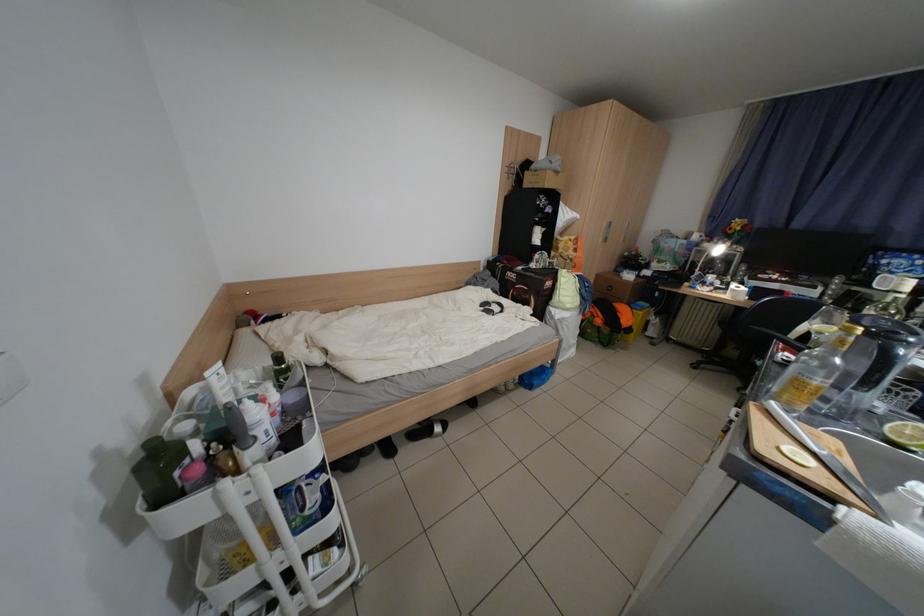
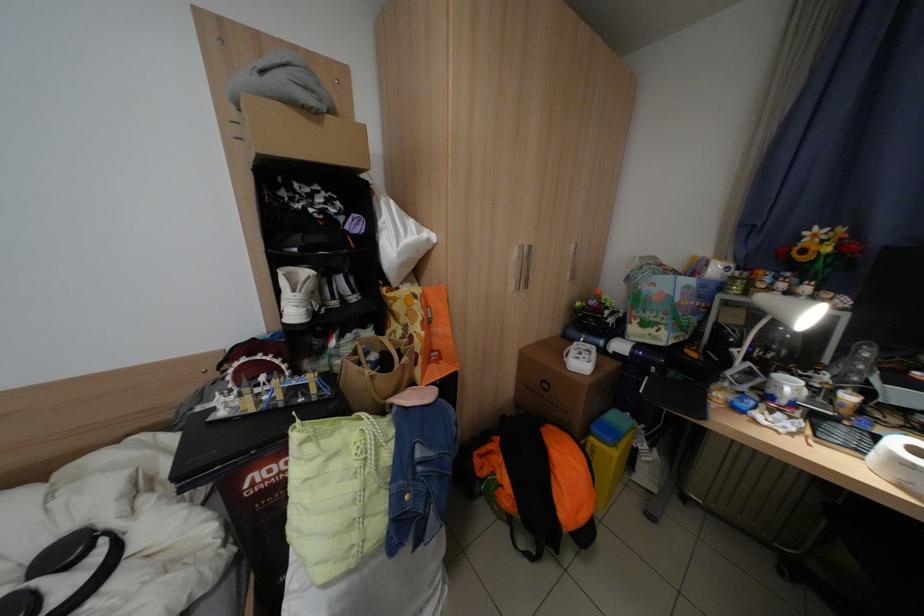
The point at (745, 286) is marked in the first image. Where is the corresponding point in the second image?

(906, 442)